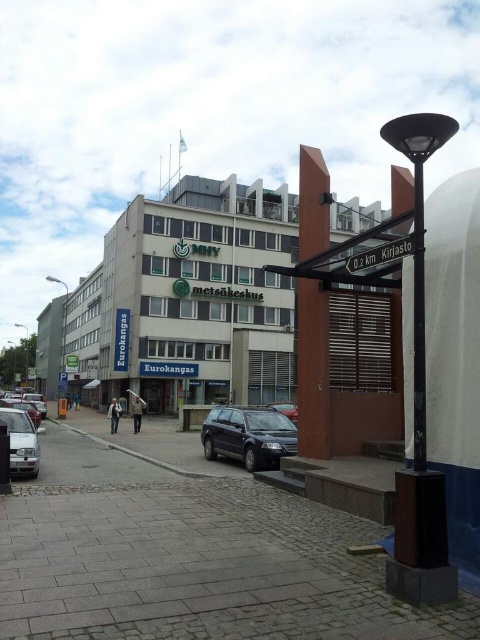
Question: Based on their relative distances, which object is farther from the silver metallic car at left?

Choices:
 (A) metallic silver car at center
 (B) white plastic sign at center
 (C) shiny black car at center

Answer: (A)

Question: Which object appears closest to the camera in this image?

Choices:
 (A) silver metallic car at left
 (B) shiny black car at center
 (C) white plastic sign at center
 (D) metallic silver car at center

Answer: (C)

Question: Does shiny black car at center have a greater width compared to white plastic sign at center?

Choices:
 (A) yes
 (B) no

Answer: (A)

Question: Which point is closer to the camera?

Choices:
 (A) (289, 406)
 (B) (228, 417)

Answer: (B)

Question: Is silver metallic car at left positioned behind metallic silver car at center?

Choices:
 (A) yes
 (B) no

Answer: (B)

Question: From the image, what is the correct spatial relationship of silver metallic car at left in relation to metallic silver car at center?

Choices:
 (A) left
 (B) right

Answer: (A)